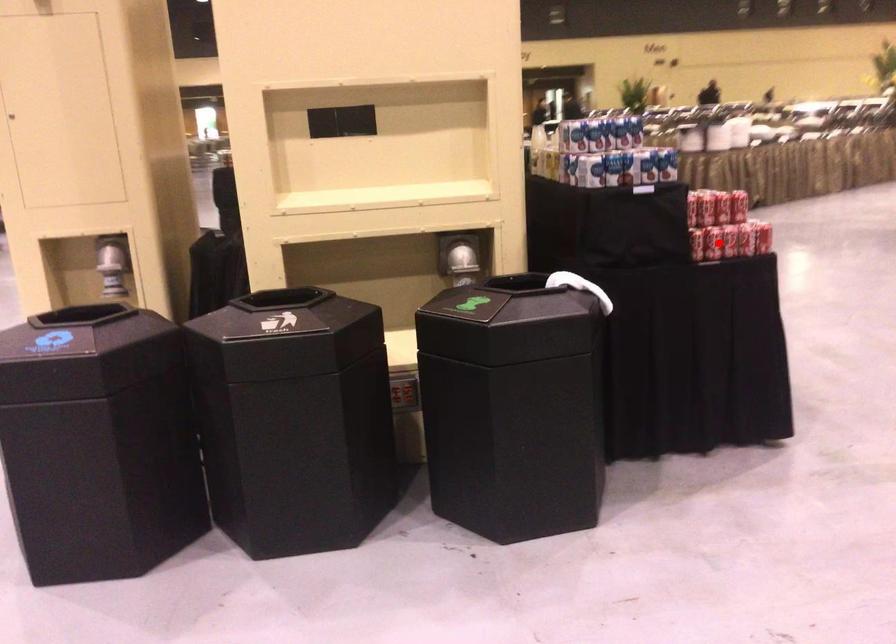
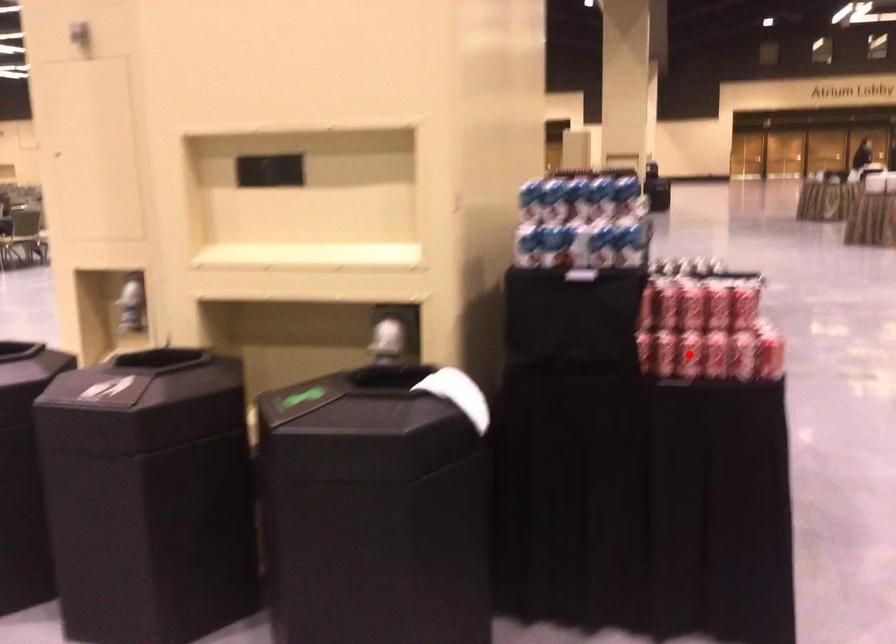
I am providing you with two images of the same scene from different viewpoints. A red point is marked on the first image and another point is marked on the second image. Does the point marked in image1 correspond to the same location as the one in image2?

Yes